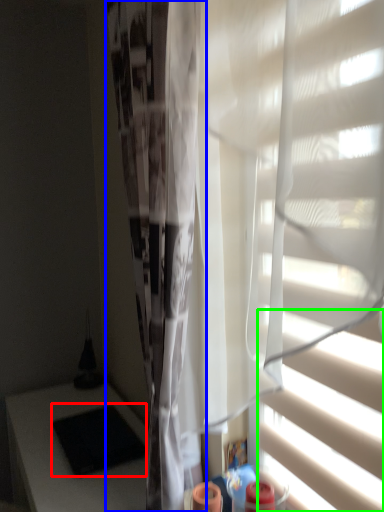
Question: Which is nearer to the pad (highlighted by a red box)? shower curtain (highlighted by a blue box) or blind (highlighted by a green box).

Choices:
 (A) shower curtain
 (B) blind

Answer: (A)